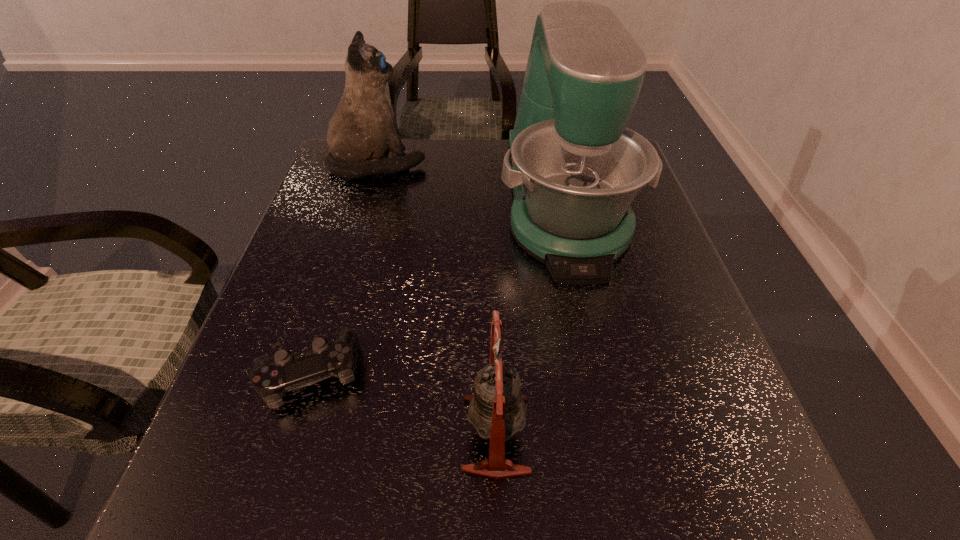
Find the location of a particular element. the tallest object is located at coordinates pyautogui.click(x=574, y=167).

I want to click on cat, so click(x=363, y=130).

Image resolution: width=960 pixels, height=540 pixels. What are the coordinates of `bell` in the screenshot? It's located at (497, 410).

Find the location of a particular element. The width and height of the screenshot is (960, 540). the shortest object is located at coordinates (271, 378).

Locate an element on the screen. The image size is (960, 540). free region located 0.310m on the front-facing side of the mixer is located at coordinates (614, 430).

Find the location of a particular element. This screenshot has height=540, width=960. free spot located at the face of the cat is located at coordinates (488, 164).

You are a GUI agent. You are given a task and a screenshot of the screen. Output one action in this format:
    pyautogui.click(x=<x>, y=<y>)
    Task: Click on the vacant area situated on the left of the third tallest object
    This screenshot has height=540, width=960.
    Given the screenshot: What is the action you would take?
    pyautogui.click(x=392, y=434)

At what (x,y) coordinates should I click in order to perform the action: click on free space located 0.210m on the back of the shortest object. Please return your answer as a coordinate pair (x, y). The image size is (960, 540). Looking at the image, I should click on (345, 258).

Identify the location of mixer that is at the far edge. This screenshot has height=540, width=960. (574, 167).

Where is `cat present at the far edge`? This screenshot has width=960, height=540. cat present at the far edge is located at coordinates (363, 130).